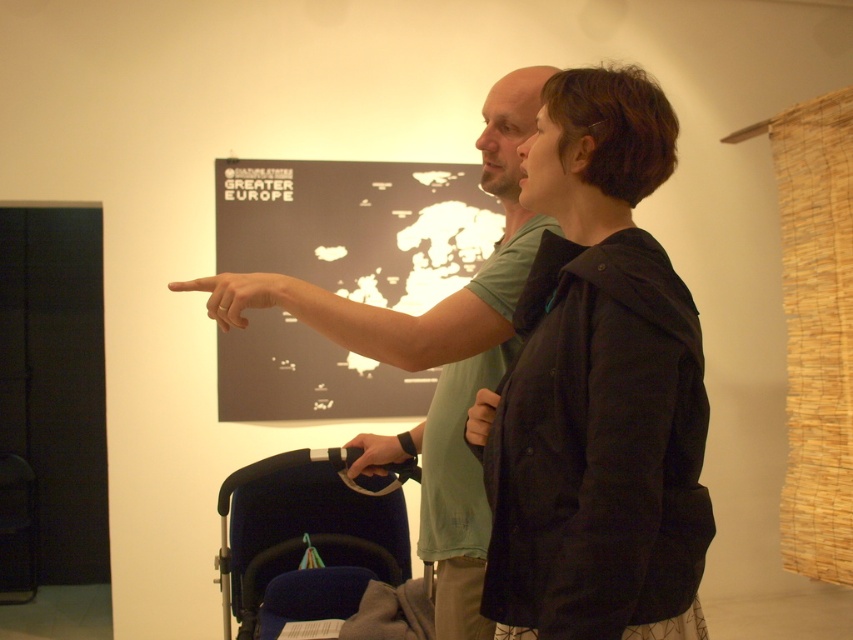
You are a person who wants to find the matte black map at center in the room. Where should you look?

A: The matte black map at center is located at the coordinates point (357, 225).